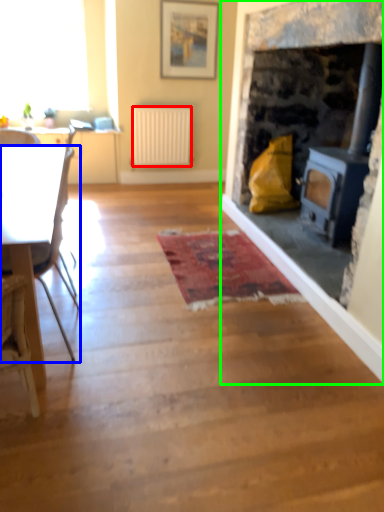
Question: Which object is the closest to the radiator (highlighted by a red box)? Choose among these: chair (highlighted by a blue box) or fireplace (highlighted by a green box).

Choices:
 (A) chair
 (B) fireplace

Answer: (B)